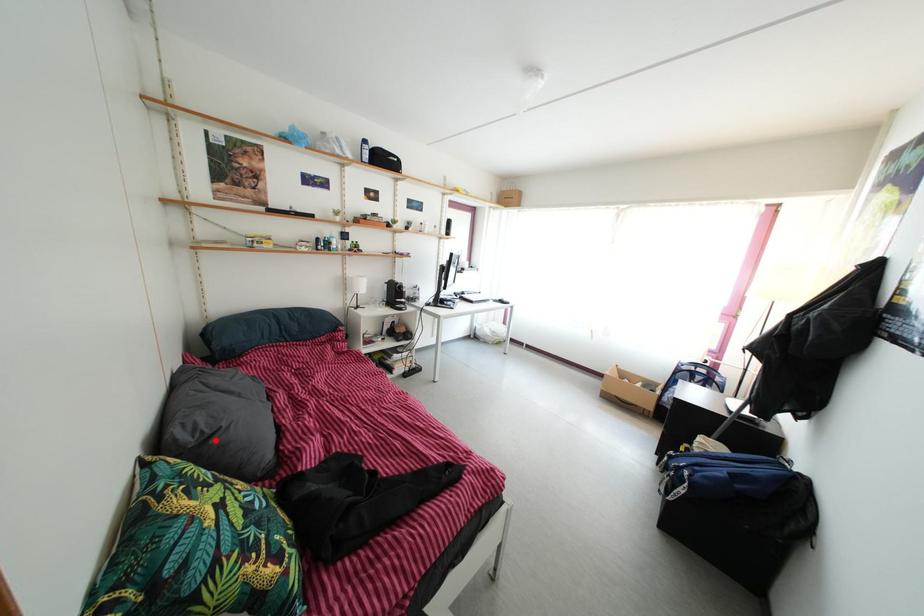
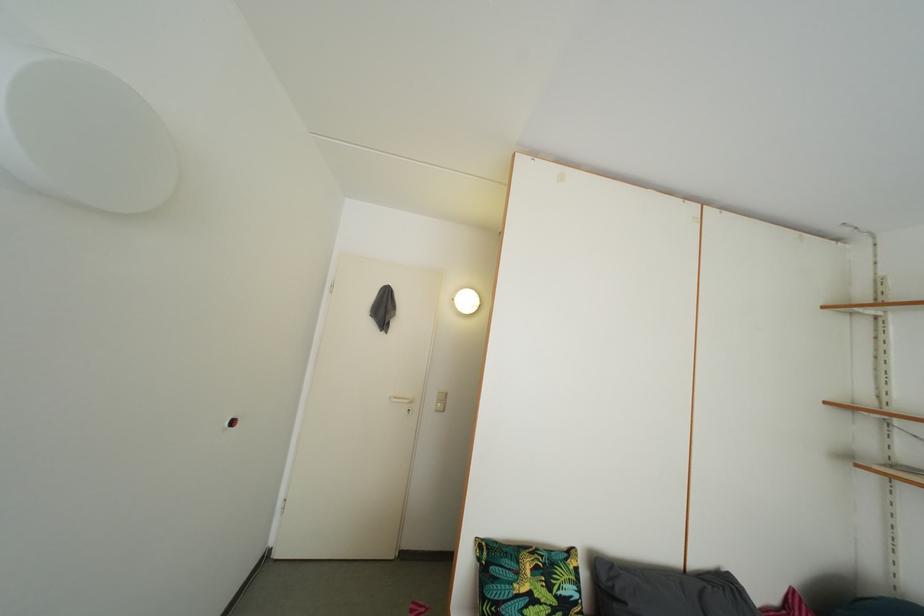
In the second image, find the point that corresponds to the highlighted location in the first image.

(624, 601)